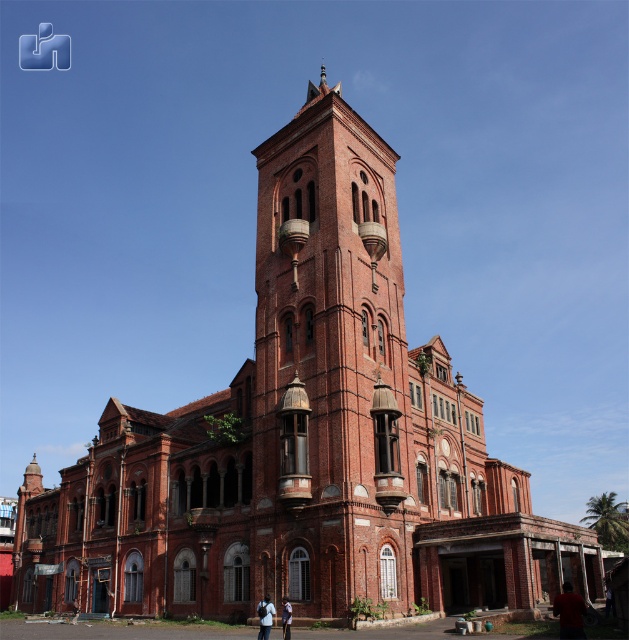
Question: Does matte red shirt at lower right appear over light blue uniform at center?

Choices:
 (A) yes
 (B) no

Answer: (A)

Question: Does dark blue fabric at lower center come in front of light blue uniform at center?

Choices:
 (A) yes
 (B) no

Answer: (B)

Question: Estimate the real-world distances between objects in this image. Which object is closer to the matte red shirt at lower right?

Choices:
 (A) dark blue fabric at lower center
 (B) light blue uniform at center
 (C) red brick bell tower at center

Answer: (B)

Question: Does dark blue fabric at lower center appear over light blue uniform at center?

Choices:
 (A) yes
 (B) no

Answer: (B)

Question: Which point is closer to the camera taking this photo?

Choices:
 (A) (387, 538)
 (B) (287, 616)
 (C) (560, 604)
 (D) (264, 625)

Answer: (C)

Question: Which object is positioned closest to the light blue uniform at center?

Choices:
 (A) dark blue fabric at lower center
 (B) red brick bell tower at center

Answer: (A)